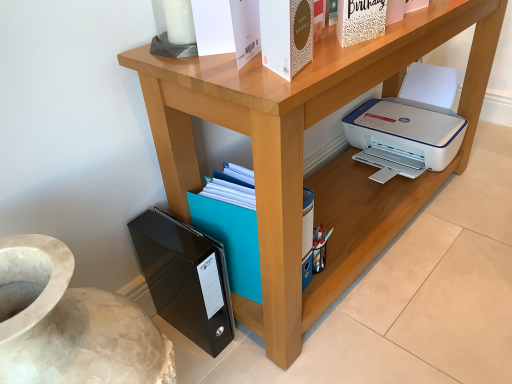
Question: Considering their positions, is black glossy file folder at lower left, which appears as the first paperback book when viewed from the left, located in front of or behind wooden printer at lower right?

Choices:
 (A) behind
 (B) front

Answer: (A)

Question: From a real-world perspective, is black glossy file folder at lower left, the third paperback book viewed from the right, positioned above or below wooden printer at lower right?

Choices:
 (A) below
 (B) above

Answer: (A)

Question: Which is nearer to the gold textured paper at upper center, which ranks as the 2th paperback book in top-to-bottom order?

Choices:
 (A) white textured paper at upper center, the second paperback book in the back-to-front sequence
 (B) wooden printer at lower right
 (C) black glossy file folder at lower left, which ranks as the 1th paperback book in back-to-front order

Answer: (A)

Question: Estimate the real-world distances between objects in this image. Which object is farther from the white textured paper at upper center, which is counted as the 3th paperback book, starting from the bottom?

Choices:
 (A) black glossy file folder at lower left, the first paperback book in the bottom-to-top sequence
 (B) wooden printer at lower right
 (C) gold textured paper at upper center, placed as the 1th paperback book when sorted from front to back

Answer: (A)